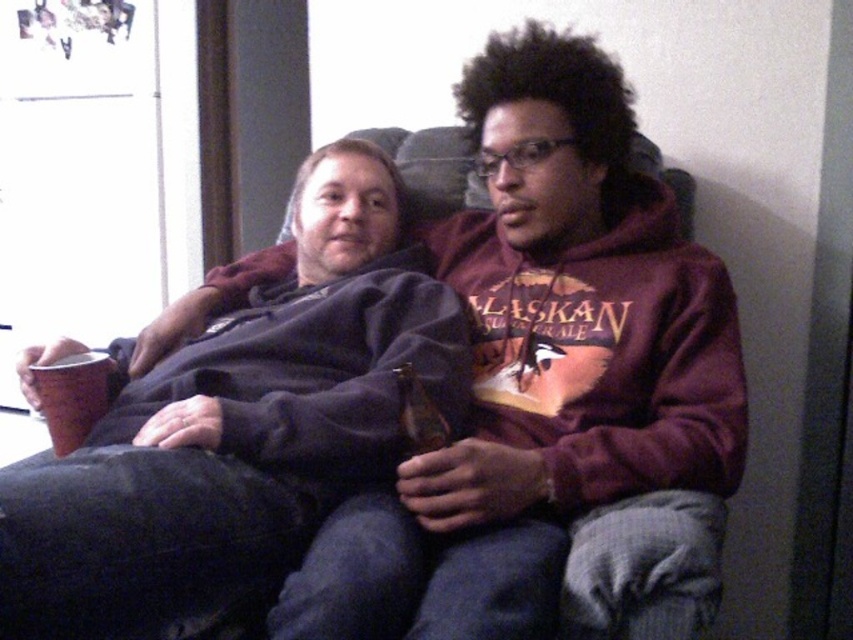
You are a photographer standing at the center of the room. You want to take a photo of the matte black mug at left. Which direction should you move to get the mug centered in your view?

The matte black mug at left is located at point (x=241, y=422). Since you are at the center, moving towards the left side of the room would center the mug in your view.

You are trying to locate the matte black hoodie at center in the image. According to the coordinates provided, where exactly is it positioned?

The matte black hoodie at center is located at point coordinates (554, 394).

You are standing in the room and want to know which of the two points, point 1 at coordinates point (355, 518) or point 2 at coordinates point (405, 438), is nearer to you. Can you determine this based on the scene?

Point 1 at coordinates point (355, 518) is closer to the viewer than point 2 at coordinates point (405, 438).